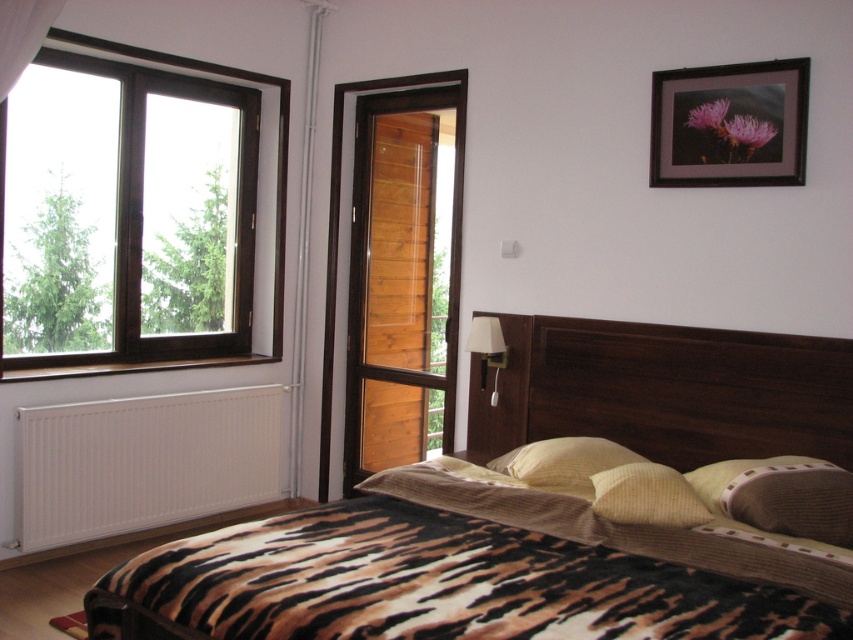
You are standing in the bedroom and want to hang a small shelf between the white matte radiator at lower left and the black matte picture frame at upper right. Since the shelf needs to be placed at a height that accommodates both objects, which object will have more space above it for the shelf?

The white matte radiator at lower left has a greater height compared to the black matte picture frame at upper right, so there will be more space above the black matte picture frame at upper right for the shelf.